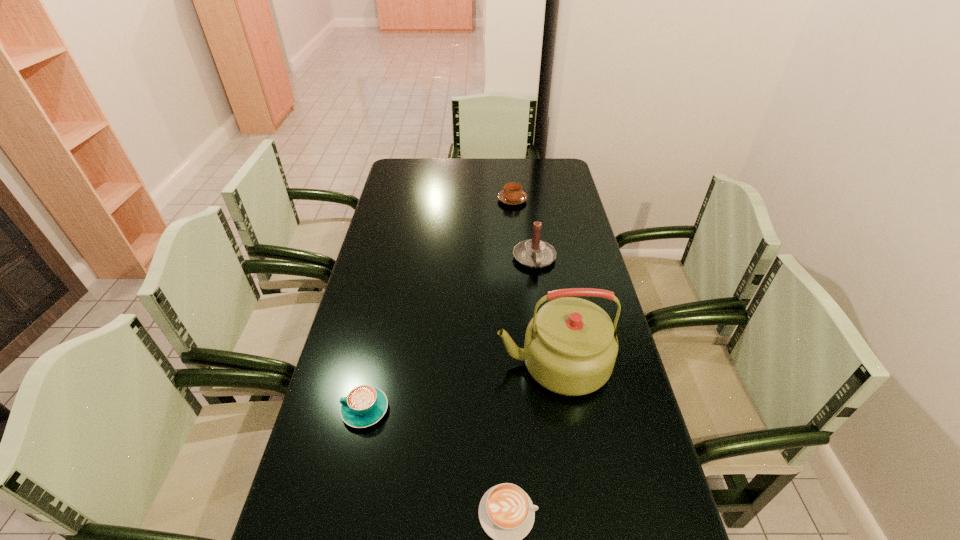
You are a GUI agent. You are given a task and a screenshot of the screen. Output one action in this format:
    pyautogui.click(x=<x>, y=<y>)
    Task: Click on the kettle
    The height and width of the screenshot is (540, 960).
    Given the screenshot: What is the action you would take?
    pyautogui.click(x=570, y=348)

At what (x,y) coordinates should I click in order to perform the action: click on the fourth shortest object. Please return your answer as a coordinate pair (x, y). The image size is (960, 540). Looking at the image, I should click on (534, 253).

Locate an element on the screen. This screenshot has width=960, height=540. the fourth nearest object is located at coordinates (534, 253).

Find the location of `the farthest object`. the farthest object is located at coordinates (512, 194).

Identify the location of the leftmost object. (365, 405).

Locate an element on the screen. the leftmost cappuccino is located at coordinates (x=365, y=405).

The width and height of the screenshot is (960, 540). What are the coordinates of `free space located at the spout of the tallest object` in the screenshot? It's located at (353, 363).

This screenshot has width=960, height=540. I want to click on vacant space located at the spout of the tallest object, so click(x=401, y=363).

Find the location of a particular element. This screenshot has width=960, height=540. vacant space located at the spout of the tallest object is located at coordinates (382, 363).

The width and height of the screenshot is (960, 540). Find the location of `free space located 0.180m on the side of the candle with the handle loop`. free space located 0.180m on the side of the candle with the handle loop is located at coordinates point(542,315).